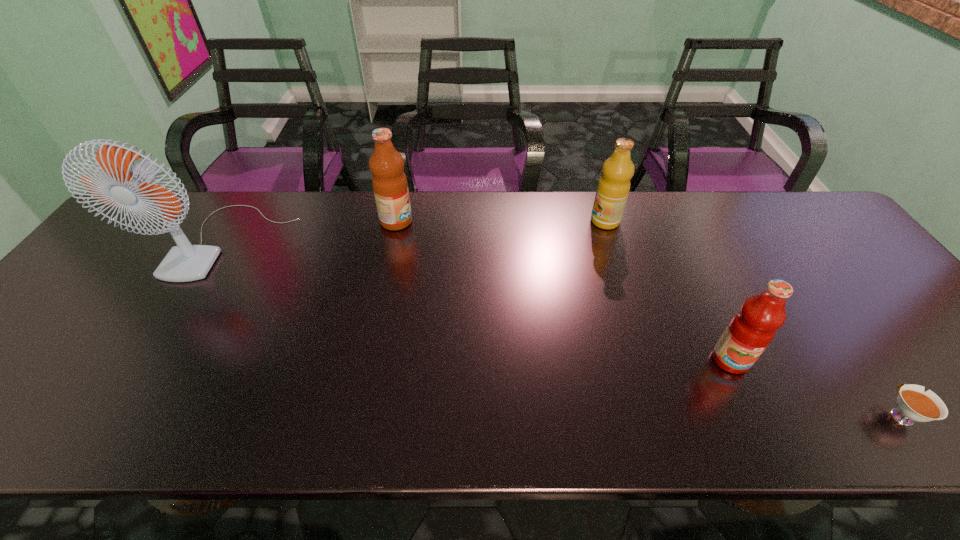
The width and height of the screenshot is (960, 540). I want to click on unoccupied position between the fourth object from right to left and the nearest fruit juice, so click(x=564, y=291).

Locate an element on the screen. free spot between the leftmost fruit juice and the rightmost fruit juice is located at coordinates (564, 291).

This screenshot has height=540, width=960. Find the location of `free spot between the third object from right to left and the leftmost object`. free spot between the third object from right to left and the leftmost object is located at coordinates (416, 231).

You are a GUI agent. You are given a task and a screenshot of the screen. Output one action in this format:
    pyautogui.click(x=<x>, y=<y>)
    Task: Click on the object that stands as the fourth closest to the second object from left to right
    
    Given the screenshot: What is the action you would take?
    pyautogui.click(x=914, y=404)

At what (x,y) coordinates should I click in order to perform the action: click on the closest object to the fourth object from right to left. Please return your answer as a coordinate pair (x, y). Looking at the image, I should click on (185, 262).

Where is `fruit juice that can be found as the second closest to the fourth object from right to left`? The height and width of the screenshot is (540, 960). fruit juice that can be found as the second closest to the fourth object from right to left is located at coordinates 751,330.

The height and width of the screenshot is (540, 960). Identify the location of fruit juice that is the closest to the third object from left to right. (751, 330).

Where is `free space that satisfies the following two spatial constraints: 1. on the front label of the third object from right to left; 2. on the side of the nearest object with the handle`? The image size is (960, 540). free space that satisfies the following two spatial constraints: 1. on the front label of the third object from right to left; 2. on the side of the nearest object with the handle is located at coordinates (665, 415).

Find the location of a particular element. vacant space that satisfies the following two spatial constraints: 1. on the front label of the second fruit juice from right to left; 2. on the side of the rightmost object with the handle is located at coordinates (665, 415).

At what (x,y) coordinates should I click in order to perform the action: click on free space that satisfies the following two spatial constraints: 1. on the side of the rightmost object with the handle; 2. on the front label of the leftmost fruit juice. Please return your answer as a coordinate pair (x, y). Looking at the image, I should click on (763, 221).